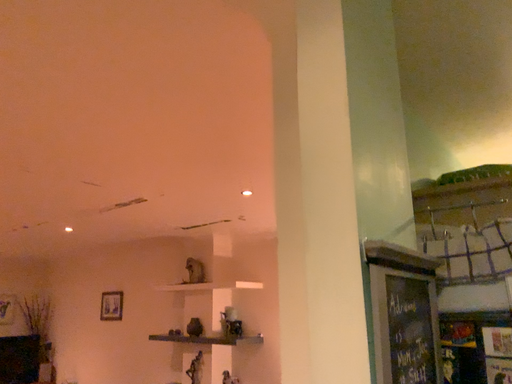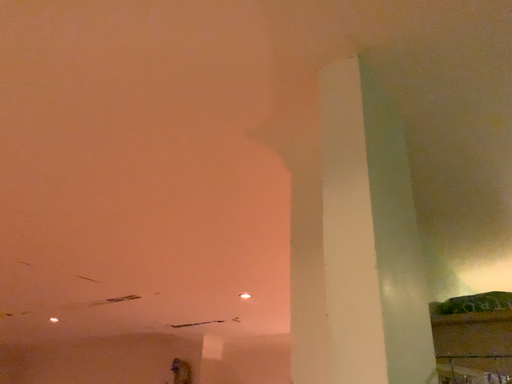
Question: Which way did the camera rotate in the video?

Choices:
 (A) rotated downward
 (B) rotated upward

Answer: (B)